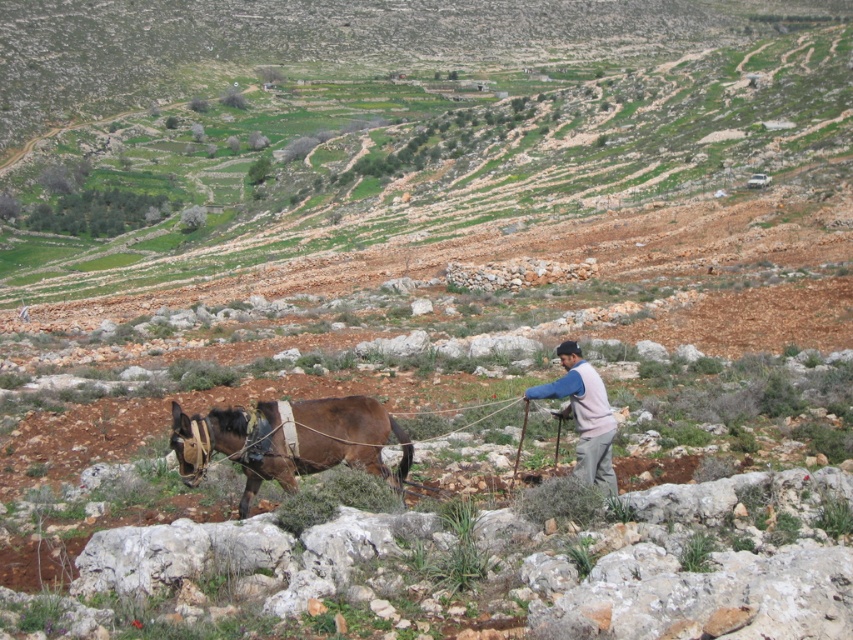
You are a traveler trying to cross this rocky terrain. You see the brown leather donkey at lower left and the light brown fabric at center. Which object is closer to the ground?

The brown leather donkey at lower left is below light brown fabric at center, so it is closer to the ground.

You are a photographer trying to capture the brown leather donkey at lower left and the brown soil at center in the same frame. Based on their positions, which object will appear closer to the camera in the photo?

The brown leather donkey at lower left will appear closer to the camera because it is positioned lower in the image, while the brown soil at center is taller and likely further away.

You are a farmer planning to plant crops in the brown soil at center. The brown leather donkey at lower left is currently blocking the path to the soil. Can the donkey move aside to allow access to the soil for planting?

The brown soil at center has a larger width than the brown leather donkey at lower left, so the donkey can move aside to allow access to the soil for planting.